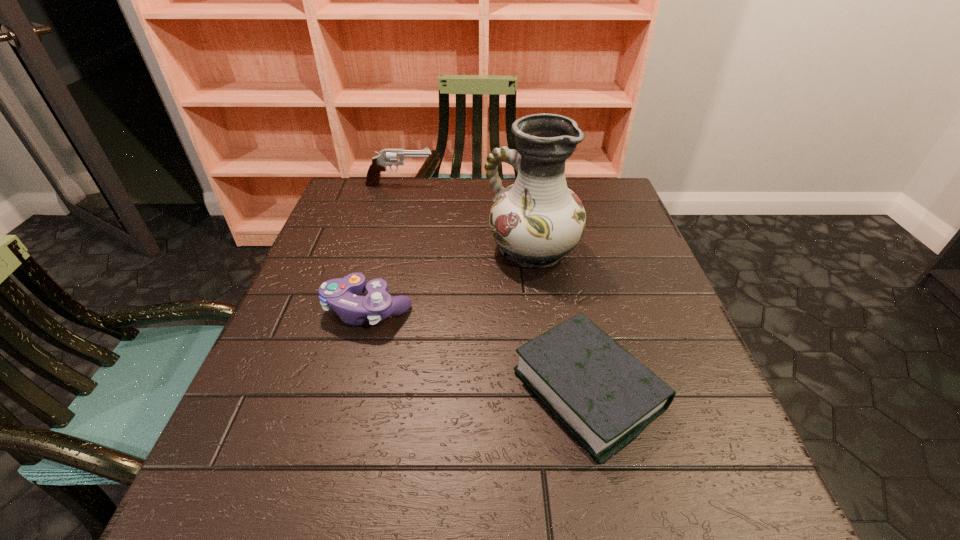
What are the coordinates of `free spot between the control and the shortest object` in the screenshot? It's located at (478, 350).

What are the coordinates of `empty location between the second tallest object and the Bible` in the screenshot? It's located at (494, 287).

In order to click on vacant region between the gun and the Bible in this screenshot , I will do `click(494, 287)`.

This screenshot has height=540, width=960. What are the coordinates of `object that stands as the third closest to the gun` in the screenshot? It's located at (606, 397).

Identify the location of object that stands as the third closest to the farthest object. This screenshot has width=960, height=540. (606, 397).

Where is `vacant position in the image that satisfies the following two spatial constraints: 1. at the muzzle of the gun; 2. on the right side of the vase`? This screenshot has width=960, height=540. vacant position in the image that satisfies the following two spatial constraints: 1. at the muzzle of the gun; 2. on the right side of the vase is located at coordinates (382, 249).

Image resolution: width=960 pixels, height=540 pixels. Identify the location of vacant area that satisfies the following two spatial constraints: 1. at the muzzle of the shortest object; 2. on the right side of the second tallest object. (344, 390).

Locate an element on the screen. The image size is (960, 540). vacant region that satisfies the following two spatial constraints: 1. on the back side of the vase; 2. at the muzzle of the second tallest object is located at coordinates (522, 185).

Identify the location of free space that satisfies the following two spatial constraints: 1. on the front side of the Bible; 2. on the left side of the tallest object. This screenshot has width=960, height=540. (552, 390).

In order to click on free space in the image that satisfies the following two spatial constraints: 1. on the back side of the third tallest object; 2. at the muzzle of the second tallest object in this screenshot , I will do `click(402, 185)`.